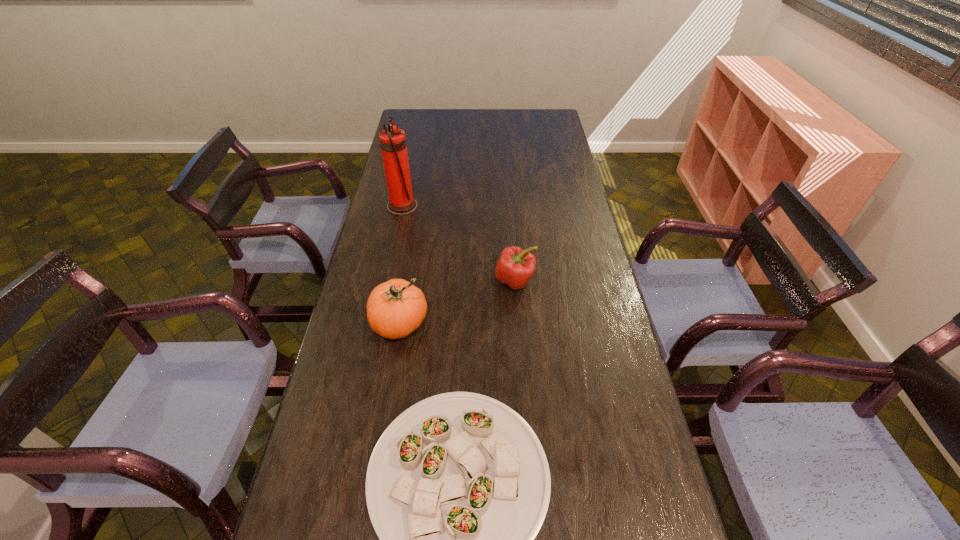
Image resolution: width=960 pixels, height=540 pixels. I want to click on pumpkin located at the left edge, so [x=395, y=308].

Where is `vacant space at the far edge`? The width and height of the screenshot is (960, 540). vacant space at the far edge is located at coordinates (456, 111).

Where is `vacant space at the left edge of the desktop`? Image resolution: width=960 pixels, height=540 pixels. vacant space at the left edge of the desktop is located at coordinates (411, 226).

The image size is (960, 540). Identify the location of vacant space at the right edge of the desktop. tap(558, 198).

The image size is (960, 540). Identify the location of free point at the far left corner. (404, 112).

At what (x,y) coordinates should I click in order to perform the action: click on free region at the far right corner. Please return your answer as a coordinate pair (x, y). Image resolution: width=960 pixels, height=540 pixels. Looking at the image, I should click on (558, 117).

Find the location of `free spot between the second shortest object and the tallest object`. free spot between the second shortest object and the tallest object is located at coordinates (459, 244).

Locate an element on the screen. This screenshot has height=540, width=960. free space between the tallest object and the bell pepper is located at coordinates (459, 244).

This screenshot has width=960, height=540. In order to click on vacant space that is in between the bell pepper and the fire extinguisher in this screenshot , I will do click(x=459, y=244).

At what (x,y) coordinates should I click in order to perform the action: click on free space between the second tallest object and the second shortest object. Please return your answer as a coordinate pair (x, y). The width and height of the screenshot is (960, 540). Looking at the image, I should click on (458, 302).